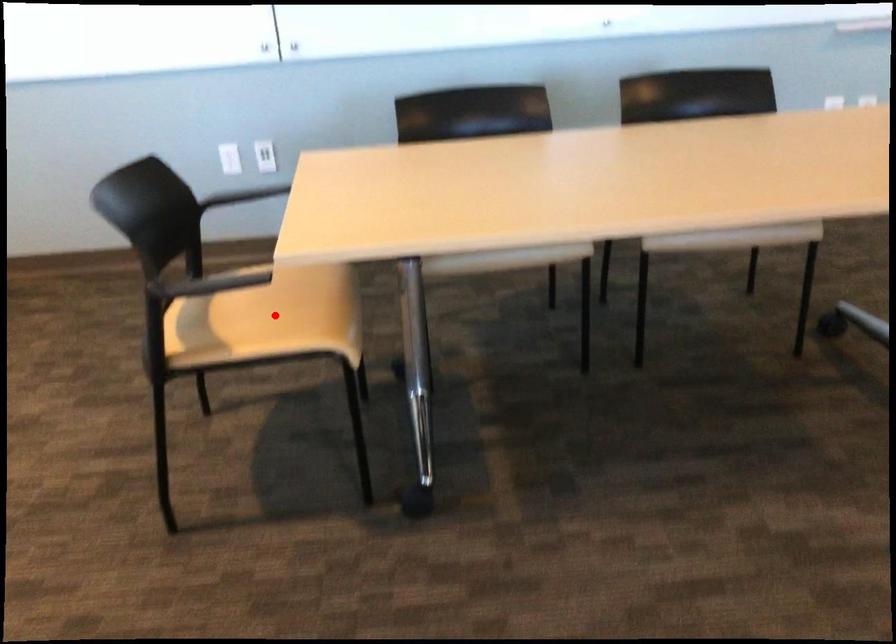
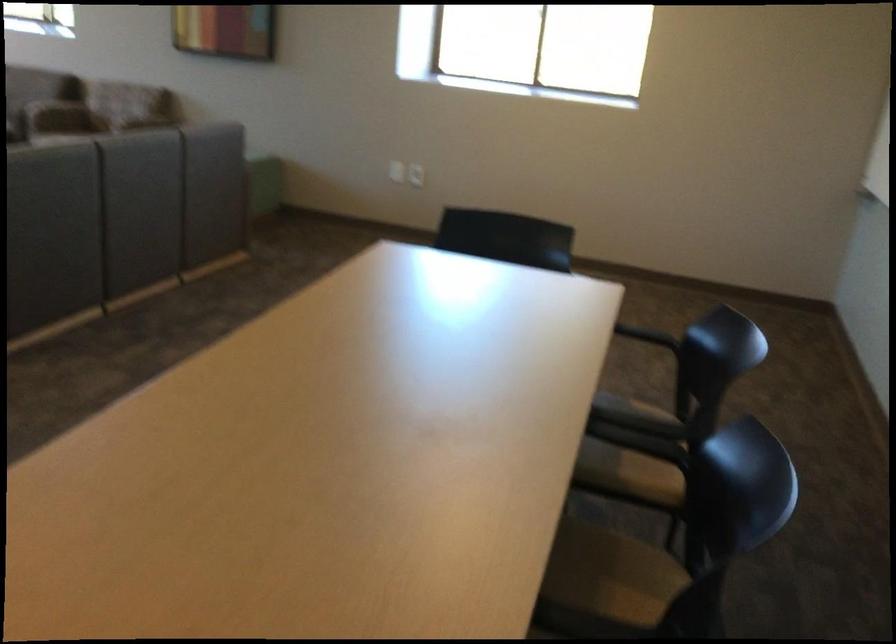
Question: I am providing you with two images of the same scene from different viewpoints. A red point is marked on the first image. Can you still see the location of the red point in image 2?

Choices:
 (A) Yes
 (B) No

Answer: (B)